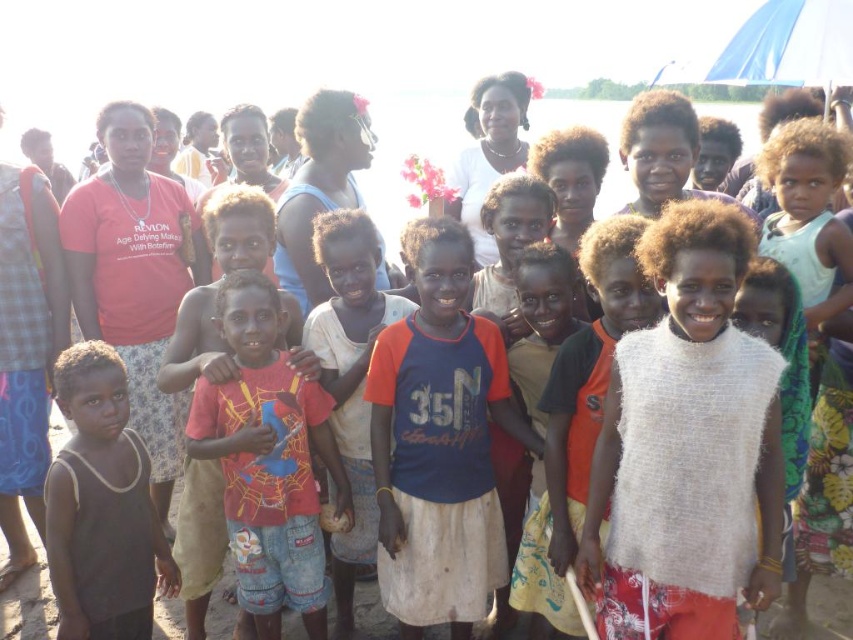
Based on the photo, is white fuzzy vest at center bigger than blue fabric shirt at center?

Yes, white fuzzy vest at center is bigger than blue fabric shirt at center.

Who is more forward, (602, 429) or (386, 461)?

Positioned in front is point (602, 429).

The height and width of the screenshot is (640, 853). What are the coordinates of `white fuzzy vest at center` in the screenshot? It's located at (688, 445).

How distant is white fuzzy vest at center from red t-shirt at center?

The distance of white fuzzy vest at center from red t-shirt at center is 2.09 meters.

Between point (650, 420) and point (263, 316), which one is positioned in front?

Point (650, 420) is more forward.

Is point (747, 380) positioned before point (233, 520)?

Yes, point (747, 380) is in front of point (233, 520).

Where is `white fuzzy vest at center`? white fuzzy vest at center is located at coordinates (688, 445).

Is white fuzzy vest at center taller than dark gray sleeveless shirt at lower left?

Yes.

Can you confirm if white fuzzy vest at center is shorter than dark gray sleeveless shirt at lower left?

No.

Which is in front, point (619, 481) or point (99, 524)?

Point (619, 481)

Where is `white fuzzy vest at center`? white fuzzy vest at center is located at coordinates (688, 445).